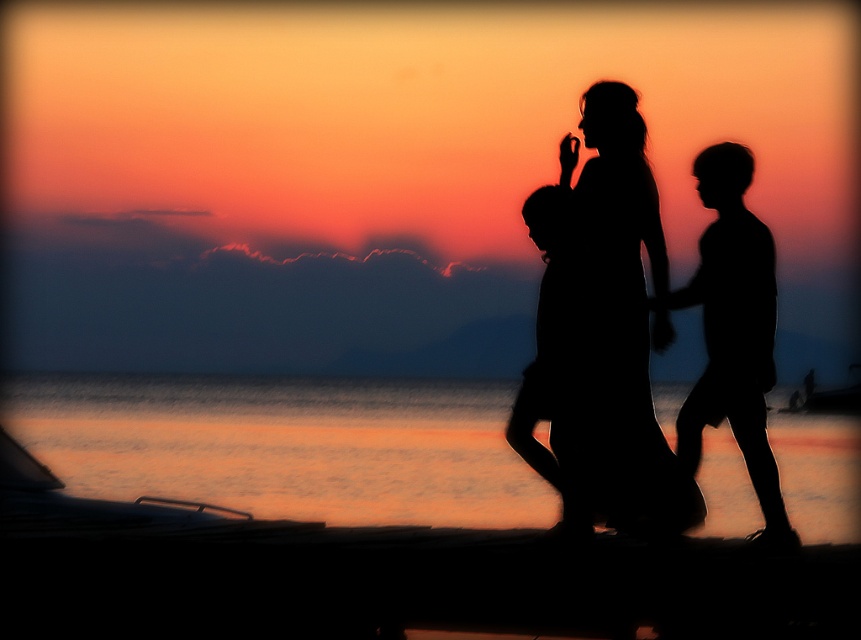
You are standing at the beach watching the sunset. You see two points marked in the scene. The first point is at coordinate point (430, 417) and the second is at point (544, 460). Which point is closer to you?

Point (430, 417) is closer to you because it is further to the camera than point (544, 460).

You are a photographer trying to capture the sunset scene. You notice the orange water at lower center and the silhouette child at center. Which object is closer to the bottom edge of the photo?

The orange water at lower center is positioned under the silhouette child at center, meaning it is closer to the bottom edge of the photo.

Consider the image. You are standing on the beach looking at the sunset. You notice the orange water at lower center and the silhouette dress at center. Which object is positioned to the left of the other?

The orange water at lower center is to the left of the silhouette dress at center.